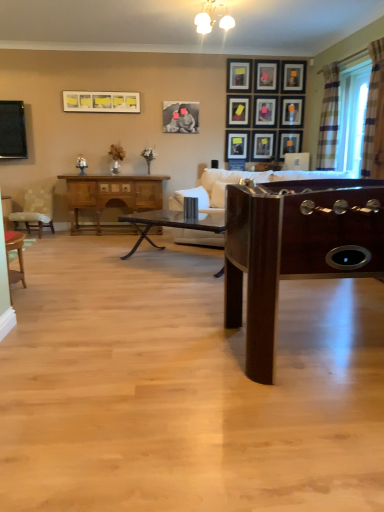
Question: Would you say white glossy light fixture at upper center is to the left or to the right of wooden cabinet at left in the picture?

Choices:
 (A) left
 (B) right

Answer: (B)

Question: From a real-world perspective, is white glossy light fixture at upper center physically located above or below wooden cabinet at left?

Choices:
 (A) below
 (B) above

Answer: (B)

Question: Which is nearer to the matte black picture frame at center, which is the sixth picture frame in right-to-left order?

Choices:
 (A) plaid fabric curtain at right, the second curtain from the back
 (B) wooden cabinet at left
 (C) patterned fabric chair at left, the second chair positioned from the front
 (D) plaid fabric curtain at right, which is counted as the 2th curtain, starting from the front
 (E) matte black picture frame at upper center, placed as the 8th picture frame when sorted from right to left

Answer: (E)

Question: Which of these objects is positioned farthest from the matte black picture frame at center, which is the sixth picture frame in right-to-left order?

Choices:
 (A) dark brown glass coffee table at center
 (B) matte black picture frame at upper center, the 9th picture frame when ordered from right to left
 (C) matte black picture frame at upper center, which is the fourth picture frame in left-to-right order
 (D) matte black picture frame at upper center, which appears as the fourth picture frame when viewed from the right
 (E) white fabric couch at center

Answer: (A)